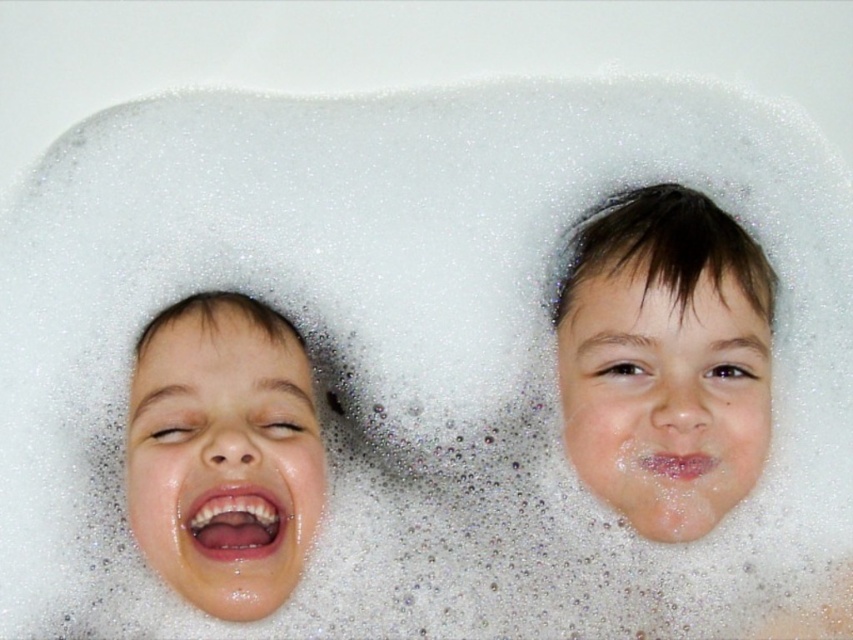
Does smooth skin face at upper center have a lesser width compared to smooth skin face at left?

In fact, smooth skin face at upper center might be wider than smooth skin face at left.

Can you confirm if smooth skin face at upper center is shorter than smooth skin face at left?

In fact, smooth skin face at upper center may be taller than smooth skin face at left.

Does point (618, 492) come closer to viewer compared to point (201, 358)?

No, (618, 492) is behind (201, 358).

Locate an element on the screen. Image resolution: width=853 pixels, height=640 pixels. smooth skin face at upper center is located at coordinates (665, 358).